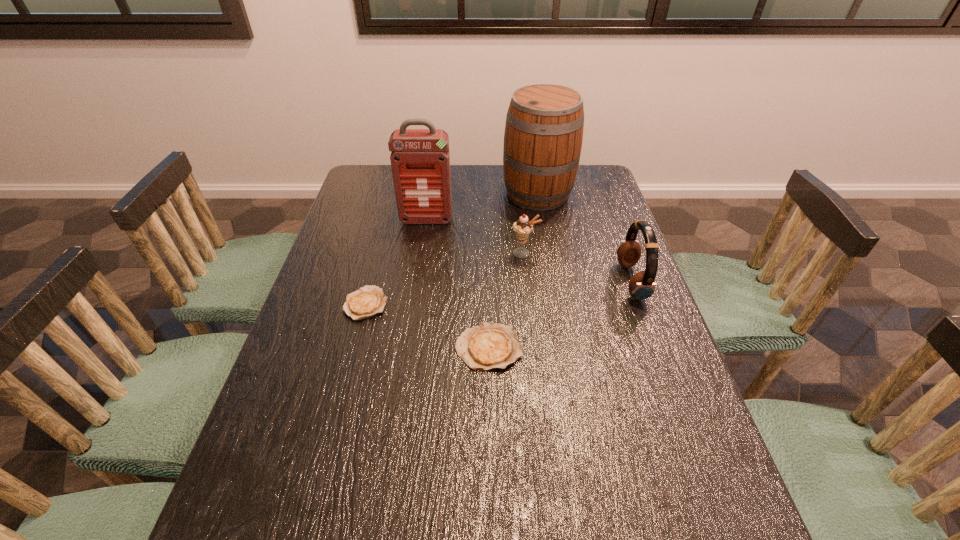
Identify the location of vacant area that lies between the fifth tallest object and the shortest object. (427, 326).

This screenshot has height=540, width=960. In order to click on free space between the third shortest object and the first-aid kit in this screenshot , I will do 475,237.

Where is `vacant space that is in between the taller quiche and the farthest object`? The image size is (960, 540). vacant space that is in between the taller quiche and the farthest object is located at coordinates (513, 271).

Where is `vacant area between the farthest object and the shortest object`? vacant area between the farthest object and the shortest object is located at coordinates (452, 248).

Locate an element on the screen. The height and width of the screenshot is (540, 960). unoccupied area between the second farthest object and the taller quiche is located at coordinates (457, 284).

You are a GUI agent. You are given a task and a screenshot of the screen. Output one action in this format:
    pyautogui.click(x=<x>, y=<y>)
    Task: Click on the free point between the left quiche and the cider
    The image size is (960, 540).
    Given the screenshot: What is the action you would take?
    pyautogui.click(x=452, y=248)

The image size is (960, 540). Identify the location of object that stands as the fifth closest to the farthest object. (488, 346).

You are a GUI agent. You are given a task and a screenshot of the screen. Output one action in this format:
    pyautogui.click(x=<x>, y=<y>)
    Task: Click on the object that is the fifth closest to the headset
    The width and height of the screenshot is (960, 540).
    Given the screenshot: What is the action you would take?
    pyautogui.click(x=368, y=301)

Locate an element on the screen. vacant space that satisfies the following two spatial constraints: 1. on the back side of the second shortest object; 2. on the left side of the cider is located at coordinates (486, 193).